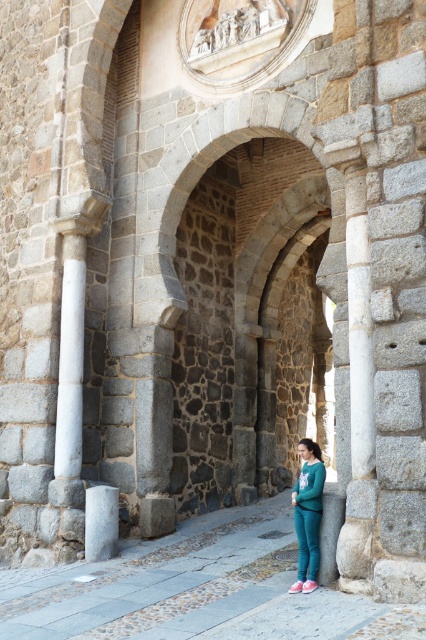
Question: Which object appears farthest from the camera in this image?

Choices:
 (A) gray stone pillar at center
 (B) teal fleece pants at lower right

Answer: (A)

Question: Can you confirm if teal fleece pants at lower right is wider than gray stone pillar at center?

Choices:
 (A) yes
 (B) no

Answer: (A)

Question: Is teal fleece pants at lower right bigger than gray stone pillar at center?

Choices:
 (A) yes
 (B) no

Answer: (A)

Question: Can you confirm if teal fleece pants at lower right is smaller than gray stone pillar at center?

Choices:
 (A) no
 (B) yes

Answer: (A)